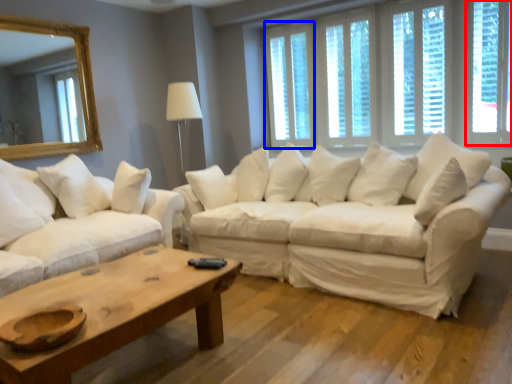
Question: Which of the following is the farthest to the observer, window (highlighted by a red box) or window (highlighted by a blue box)?

Choices:
 (A) window
 (B) window

Answer: (B)